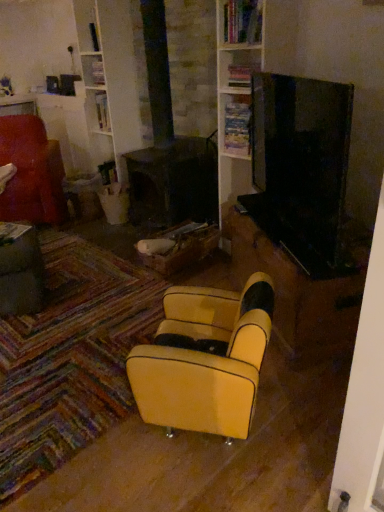
Where is `metallic gray table at lower left`? metallic gray table at lower left is located at coordinates (21, 271).

Would you say metallic gray table at lower left contains wooden bookshelf at upper center, which appears as the 1th shelf when ordered from the bottom?

No.

Is metallic gray table at lower left in front of or behind wooden bookshelf at upper center, which appears as the 1th shelf when ordered from the bottom, in the image?

metallic gray table at lower left is positioned closer to the viewer than wooden bookshelf at upper center, which appears as the 1th shelf when ordered from the bottom.

From a real-world perspective, is metallic gray table at lower left over wooden bookshelf at upper center, positioned as the second shelf in top-to-bottom order?

No.

Is point (31, 298) in front of point (231, 95)?

Yes, point (31, 298) is in front of point (231, 95).

Which object is further away from the camera taking this photo, metallic gray table at lower left or yellow leather chair at center, which appears as the 2th chair when viewed from the back?

metallic gray table at lower left.

Would you consider metallic gray table at lower left to be distant from yellow leather chair at center, which appears as the 2th chair when viewed from the back?

metallic gray table at lower left is positioned a significant distance from yellow leather chair at center, which appears as the 2th chair when viewed from the back.

Which of these two, metallic gray table at lower left or yellow leather chair at center, which is the 2th chair in top-to-bottom order, stands shorter?

Standing shorter between the two is metallic gray table at lower left.

How different are the orientations of metallic gray table at lower left and yellow leather chair at center, which is the second chair from left to right, in degrees?

The angle between the facing direction of metallic gray table at lower left and the facing direction of yellow leather chair at center, which is the second chair from left to right, is 28.6 degrees.

Does wooden bookshelf at upper center, positioned as the second shelf in top-to-bottom order, have a greater width compared to velvet red armchair at left, which is counted as the 1th chair, starting from the left?

No.

In the scene shown: Is wooden bookshelf at upper center, which appears as the 1th shelf when ordered from the bottom, not inside velvet red armchair at left, which is counted as the 1th chair, starting from the left?

wooden bookshelf at upper center, which appears as the 1th shelf when ordered from the bottom, is positioned outside velvet red armchair at left, which is counted as the 1th chair, starting from the left.

Is wooden bookshelf at upper center, which appears as the 1th shelf when ordered from the bottom, smaller than velvet red armchair at left, the 2th chair positioned from the bottom?

Indeed, wooden bookshelf at upper center, which appears as the 1th shelf when ordered from the bottom, has a smaller size compared to velvet red armchair at left, the 2th chair positioned from the bottom.

Where is `the 1st shelf counting from the right of the metallic gray table at lower left`? the 1st shelf counting from the right of the metallic gray table at lower left is located at coordinates (237, 125).

Is metallic gray table at lower left surrounded by wooden bookshelf at upper center, which appears as the 1th shelf when ordered from the bottom?

No, metallic gray table at lower left is located outside of wooden bookshelf at upper center, which appears as the 1th shelf when ordered from the bottom.

Is wooden bookshelf at upper center, positioned as the second shelf in top-to-bottom order, aimed at metallic gray table at lower left?

No, wooden bookshelf at upper center, positioned as the second shelf in top-to-bottom order, is not facing towards metallic gray table at lower left.

Which of these two, wooden bookshelf at upper center, positioned as the second shelf in top-to-bottom order, or metallic gray table at lower left, stands taller?

With more height is metallic gray table at lower left.

Looking at this image, relative to wooden bookshelf at upper center, which is the first shelf from top to bottom, is metallic gray table at lower left in front or behind?

Visually, metallic gray table at lower left is located in front of wooden bookshelf at upper center, which is the first shelf from top to bottom.

Which is closer to the camera, [3,297] or [256,11]?

The point [3,297] is closer to the camera.

Considering the relative sizes of metallic gray table at lower left and wooden bookshelf at upper center, which is the 2th shelf in bottom-to-top order, in the image provided, is metallic gray table at lower left smaller than wooden bookshelf at upper center, which is the 2th shelf in bottom-to-top order,?

Actually, metallic gray table at lower left might be larger than wooden bookshelf at upper center, which is the 2th shelf in bottom-to-top order.

Between yellow leather chair at center, which is the 2th chair in top-to-bottom order, and metallic gray table at lower left, which one appears on the left side from the viewer's perspective?

From the viewer's perspective, metallic gray table at lower left appears more on the left side.

How many degrees apart are the facing directions of yellow leather chair at center, the 1th chair ordered from the bottom, and metallic gray table at lower left?

The facing directions of yellow leather chair at center, the 1th chair ordered from the bottom, and metallic gray table at lower left are 28.6 degrees apart.

Is yellow leather chair at center, which is the 2th chair in top-to-bottom order, not close to metallic gray table at lower left?

That's right, there is a large distance between yellow leather chair at center, which is the 2th chair in top-to-bottom order, and metallic gray table at lower left.

Does point (249, 296) come farther from viewer compared to point (4, 290)?

No, it is in front of (4, 290).

Which point is more forward, [12,182] or [22,256]?

The point [22,256] is closer to the camera.

What's the angular difference between velvet red armchair at left, the 2th chair positioned from the bottom, and metallic gray table at lower left's facing directions?

They differ by 81.9 degrees in their facing directions.

Is metallic gray table at lower left inside velvet red armchair at left, the 2th chair positioned from the bottom?

No, velvet red armchair at left, the 2th chair positioned from the bottom, does not contain metallic gray table at lower left.

Where is `shelf that is the 1st one when counting upward from the metallic gray table at lower left (from the image's perspective)`? shelf that is the 1st one when counting upward from the metallic gray table at lower left (from the image's perspective) is located at coordinates (237, 125).

Identify the location of chair that is the 1st one above the metallic gray table at lower left (from a real-world perspective). (205, 360).

Estimate the real-world distances between objects in this image. Which object is closer to wooden bookshelf at upper center, which is the first shelf from top to bottom, metallic gray table at lower left or wooden bookshelf at upper center, positioned as the second shelf in top-to-bottom order?

The object closer to wooden bookshelf at upper center, which is the first shelf from top to bottom, is wooden bookshelf at upper center, positioned as the second shelf in top-to-bottom order.

Considering their positions, is wooden bookshelf at upper center, positioned as the second shelf in top-to-bottom order, positioned closer to wooden bookshelf at upper center, which is the first shelf from top to bottom, than velvet red armchair at left, which is the second chair in right-to-left order?

wooden bookshelf at upper center, positioned as the second shelf in top-to-bottom order, is closer to wooden bookshelf at upper center, which is the first shelf from top to bottom.

Considering their positions, is metallic gray table at lower left positioned closer to velvet red armchair at left, the 2th chair positioned from the bottom, than wooden bookshelf at upper center, which appears as the 1th shelf when ordered from the bottom?

metallic gray table at lower left lies closer to velvet red armchair at left, the 2th chair positioned from the bottom, than the other object.

Based on their spatial positions, is wooden bookshelf at upper center, which is the first shelf from top to bottom, or wooden bookshelf at upper center, positioned as the second shelf in top-to-bottom order, closer to velvet red armchair at left, placed as the first chair when sorted from top to bottom?

The object closer to velvet red armchair at left, placed as the first chair when sorted from top to bottom, is wooden bookshelf at upper center, positioned as the second shelf in top-to-bottom order.

Looking at the image, which one is located further to metallic gray table at lower left, yellow leather chair at center, which is the 2th chair in top-to-bottom order, or velvet red armchair at left, which is counted as the 1th chair, starting from the left?

yellow leather chair at center, which is the 2th chair in top-to-bottom order, is positioned further to the anchor metallic gray table at lower left.

Considering their positions, is velvet red armchair at left, the 2th chair in the front-to-back sequence, positioned further to yellow leather chair at center, which is the second chair from left to right, than metallic gray table at lower left?

velvet red armchair at left, the 2th chair in the front-to-back sequence.

Based on their spatial positions, is velvet red armchair at left, the 2th chair positioned from the bottom, or yellow leather chair at center, which appears as the 2th chair when viewed from the back, closer to metallic gray table at lower left?

The object closer to metallic gray table at lower left is velvet red armchair at left, the 2th chair positioned from the bottom.

Looking at this image, when comparing their distances from yellow leather chair at center, which is counted as the first chair, starting from the right, does metallic gray table at lower left or wooden bookshelf at upper center, positioned as the second shelf in top-to-bottom order, seem closer?

Based on the image, metallic gray table at lower left appears to be nearer to yellow leather chair at center, which is counted as the first chair, starting from the right.

Identify the location of chair between velvet red armchair at left, which ranks as the 1th chair in back-to-front order, and wooden bookshelf at upper center, which is the 2th shelf in bottom-to-top order, from left to right. Image resolution: width=384 pixels, height=512 pixels. (205, 360).

Find the location of a particular element. Image resolution: width=384 pixels, height=512 pixels. table between wooden bookshelf at upper center, which is the 2th shelf in bottom-to-top order, and yellow leather chair at center, which is the 2th chair in top-to-bottom order, vertically is located at coordinates (21, 271).

Where is `chair situated between metallic gray table at lower left and wooden bookshelf at upper center, which appears as the 1th shelf when ordered from the bottom, from left to right`? Image resolution: width=384 pixels, height=512 pixels. chair situated between metallic gray table at lower left and wooden bookshelf at upper center, which appears as the 1th shelf when ordered from the bottom, from left to right is located at coordinates (205, 360).

I want to click on table between velvet red armchair at left, placed as the first chair when sorted from top to bottom, and wooden bookshelf at upper center, which is the first shelf from top to bottom, so (x=21, y=271).